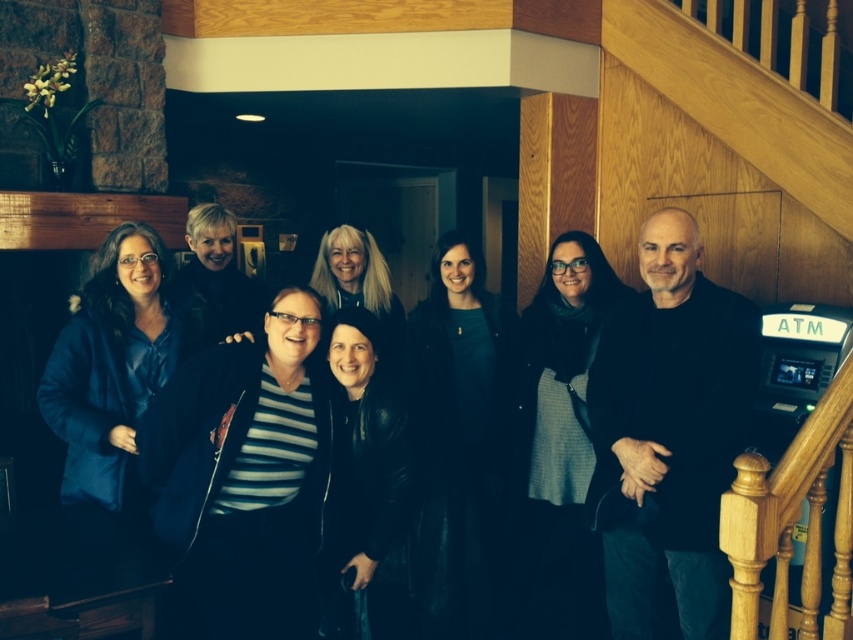
You are standing in the lobby and see the matte blue jacket at left and the black leather jacket at center. Which jacket is positioned further to the left?

The matte blue jacket at left is positioned further to the left than the black leather jacket at center.

You are organizing a clothing donation drive and need to stack jackets. You have a dark blue leather jacket at center and a black leather jacket at center. If you want to place the dark blue one on top, is it already in the correct position?

Yes, the dark blue leather jacket at center is already positioned over the black leather jacket at center, so it is correctly placed as desired.

You are a fashion designer observing the group of seven individuals in the image. You need to determine which jacket, the dark blue leather jacket at center or the black leather jacket at center, is more suitable for a taller model. Based on the jackets, which one would you choose?

The dark blue leather jacket at center is much taller than the black leather jacket at center, so it would be more suitable for a taller model.